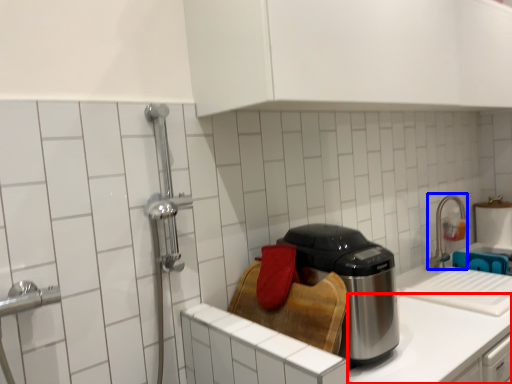
Question: Which of the following is the farthest to the observer, counter top (highlighted by a red box) or faucet (highlighted by a blue box)?

Choices:
 (A) counter top
 (B) faucet

Answer: (B)